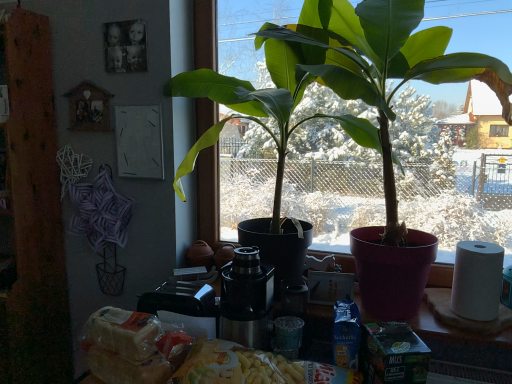
Question: From a real-world perspective, is green matte plant at center physically above stainless steel coffee machine at center?

Choices:
 (A) yes
 (B) no

Answer: (A)

Question: Is green matte plant at center in contact with stainless steel coffee machine at center?

Choices:
 (A) yes
 (B) no

Answer: (B)

Question: Is green matte plant at center further to the viewer compared to stainless steel coffee machine at center?

Choices:
 (A) yes
 (B) no

Answer: (A)

Question: Can you confirm if green matte plant at center is thinner than stainless steel coffee machine at center?

Choices:
 (A) no
 (B) yes

Answer: (B)

Question: Is green matte plant at center located outside stainless steel coffee machine at center?

Choices:
 (A) no
 (B) yes

Answer: (B)

Question: Considering the positions of yellow matte pasta at lower center and white matte paper towel at right in the image, is yellow matte pasta at lower center bigger or smaller than white matte paper towel at right?

Choices:
 (A) small
 (B) big

Answer: (B)

Question: Considering their positions, is yellow matte pasta at lower center located in front of or behind white matte paper towel at right?

Choices:
 (A) behind
 (B) front

Answer: (B)

Question: From a real-world perspective, relative to white matte paper towel at right, is yellow matte pasta at lower center vertically above or below?

Choices:
 (A) below
 (B) above

Answer: (A)

Question: Looking at their shapes, would you say yellow matte pasta at lower center is wider or thinner than white matte paper towel at right?

Choices:
 (A) thin
 (B) wide

Answer: (B)

Question: Is stainless steel coffee machine at center taller or shorter than green matte plant at center?

Choices:
 (A) tall
 (B) short

Answer: (B)

Question: Considering the positions of point (262, 269) and point (376, 291), is point (262, 269) closer or farther from the camera than point (376, 291)?

Choices:
 (A) farther
 (B) closer

Answer: (B)

Question: Is stainless steel coffee machine at center in front of or behind green matte plant at center in the image?

Choices:
 (A) behind
 (B) front

Answer: (B)

Question: Based on their positions, is stainless steel coffee machine at center located to the left or right of green matte plant at center?

Choices:
 (A) right
 (B) left

Answer: (B)

Question: Considering the relative positions of stainless steel coffee machine at center and yellow matte pasta at lower center in the image provided, is stainless steel coffee machine at center to the left or to the right of yellow matte pasta at lower center?

Choices:
 (A) right
 (B) left

Answer: (B)

Question: From a real-world perspective, relative to yellow matte pasta at lower center, is stainless steel coffee machine at center vertically above or below?

Choices:
 (A) below
 (B) above

Answer: (B)